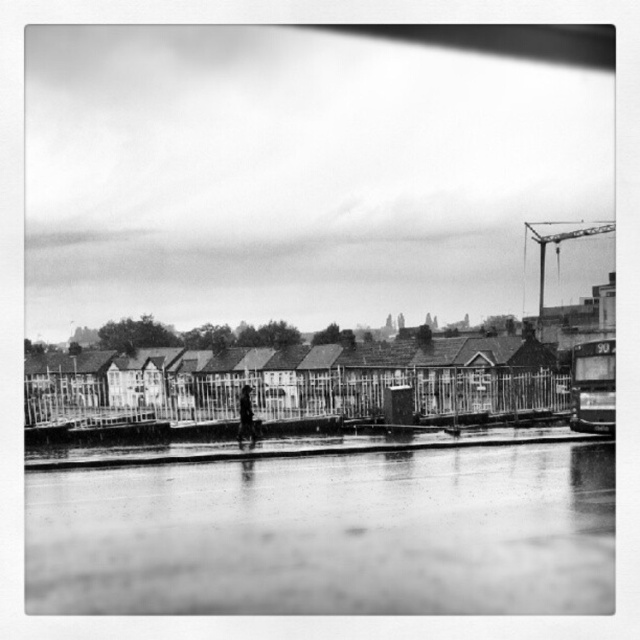
Can you confirm if metallic gray crane at upper right is taller than dark clothing figure at center?

Correct, metallic gray crane at upper right is much taller as dark clothing figure at center.

Is point (538, 221) positioned before point (244, 426)?

That is False.

Is point (536, 225) positioned after point (246, 404)?

Yes, it is behind point (246, 404).

You are a GUI agent. You are given a task and a screenshot of the screen. Output one action in this format:
    pyautogui.click(x=<x>, y=<y>)
    Task: Click on the metallic gray crane at upper right
    This screenshot has width=640, height=640.
    Given the screenshot: What is the action you would take?
    pyautogui.click(x=557, y=243)

In the scene shown: Between wet asphalt flood at lower center and dark clothing figure at center, which one has more height?

dark clothing figure at center is taller.

Is wet asphalt flood at lower center closer to camera compared to dark clothing figure at center?

That is True.

Find the location of a particular element. This screenshot has width=640, height=640. wet asphalt flood at lower center is located at coordinates (330, 534).

You are a GUI agent. You are given a task and a screenshot of the screen. Output one action in this format:
    pyautogui.click(x=<x>, y=<y>)
    Task: Click on the wet asphalt flood at lower center
    Image resolution: width=640 pixels, height=640 pixels.
    Given the screenshot: What is the action you would take?
    pyautogui.click(x=330, y=534)

Which of these two, wet asphalt flood at lower center or metallic gray crane at upper right, stands taller?

metallic gray crane at upper right is taller.

Can you confirm if wet asphalt flood at lower center is smaller than metallic gray crane at upper right?

Yes, wet asphalt flood at lower center is smaller than metallic gray crane at upper right.

Locate an element on the screen. The height and width of the screenshot is (640, 640). wet asphalt flood at lower center is located at coordinates (330, 534).